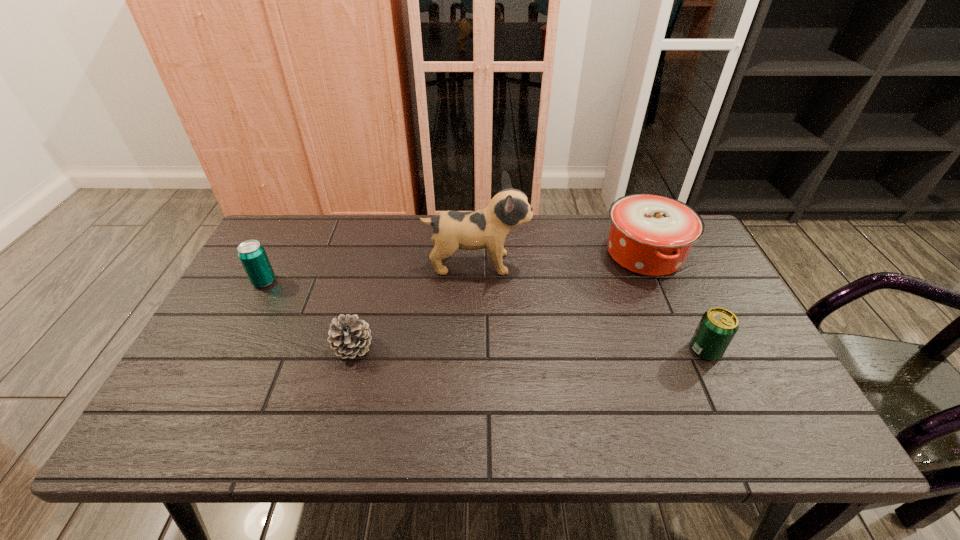
Locate an element on the screen. The width and height of the screenshot is (960, 540). free spot located 0.190m on the front of the nearer beer can is located at coordinates (746, 437).

You are a GUI agent. You are given a task and a screenshot of the screen. Output one action in this format:
    pyautogui.click(x=<x>, y=<y>)
    Task: Click on the free point located on the left of the second object from left to right
    The image size is (960, 540).
    Given the screenshot: What is the action you would take?
    pyautogui.click(x=264, y=348)

Identify the location of puppy at the far edge. This screenshot has height=540, width=960. (488, 228).

You are a GUI agent. You are given a task and a screenshot of the screen. Output one action in this format:
    pyautogui.click(x=<x>, y=<y>)
    Task: Click on the casserole located at the far edge
    
    Given the screenshot: What is the action you would take?
    pyautogui.click(x=650, y=234)

At what (x,y) coordinates should I click in order to perform the action: click on object that is at the left edge. Please return your answer as a coordinate pair (x, y). Image resolution: width=960 pixels, height=540 pixels. Looking at the image, I should click on (251, 253).

Image resolution: width=960 pixels, height=540 pixels. I want to click on casserole that is at the right edge, so click(650, 234).

At what (x,y) coordinates should I click in order to perform the action: click on beer can present at the right edge. Please return your answer as a coordinate pair (x, y). Looking at the image, I should click on (718, 326).

Identify the location of object situated at the far right corner. The height and width of the screenshot is (540, 960). (650, 234).

At what (x,y) coordinates should I click in order to perform the action: click on free space at the far edge of the desktop. Please return your answer as a coordinate pair (x, y). Looking at the image, I should click on (388, 246).

The height and width of the screenshot is (540, 960). In order to click on vacant region at the near edge of the desktop in this screenshot , I will do `click(361, 416)`.